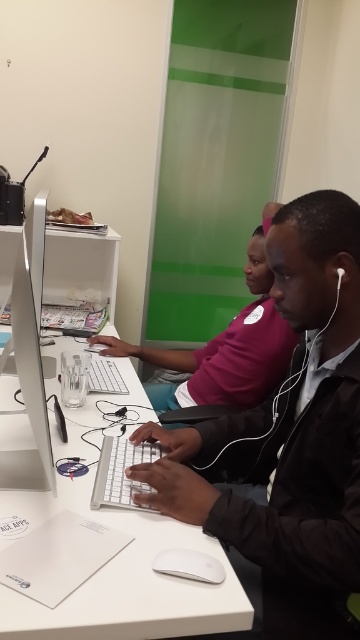
Question: Which point is closer to the camera taking this photo?

Choices:
 (A) (264, 342)
 (B) (138, 524)
 (C) (209, 576)

Answer: (C)

Question: Does black matte jacket at center have a smaller size compared to white plastic computer desk at center?

Choices:
 (A) yes
 (B) no

Answer: (A)

Question: From the image, what is the correct spatial relationship of white plastic computer desk at center in relation to white matte mouse at center?

Choices:
 (A) right
 (B) left

Answer: (B)

Question: Can you confirm if white plastic computer desk at center is wider than white matte mouse at center?

Choices:
 (A) no
 (B) yes

Answer: (B)

Question: Which of the following is the farthest from the observer?

Choices:
 (A) matte black shirt at center
 (B) black matte jacket at center
 (C) sleek silver monitor at left

Answer: (A)

Question: Estimate the real-world distances between objects in this image. Which object is farther from the black matte jacket at center?

Choices:
 (A) matte black shirt at center
 (B) white plastic computer desk at center
 (C) white matte mouse at center

Answer: (A)